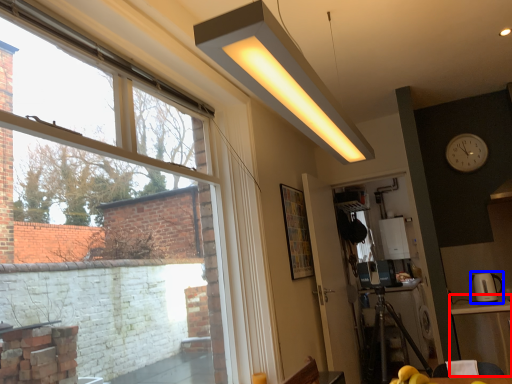
Question: Which of the following is the closest to the observer, table (highlighted by a red box) or appliance (highlighted by a blue box)?

Choices:
 (A) table
 (B) appliance

Answer: (A)